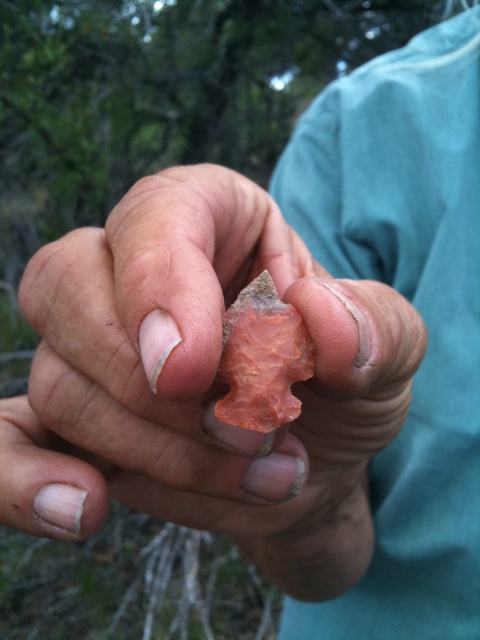
You are an archaeologist examining two matte orange stone objects in the image. Which one is bigger between the matte orange stone arrowhead at center and the matte orange stone at center?

The matte orange stone arrowhead at center is larger than the matte orange stone at center.

You are an archaeologist examining two objects in your hands. You have a matte orange stone arrowhead at center and a matte orange stone at center. Which object is taller?

The matte orange stone arrowhead at center is much taller than the matte orange stone at center.

You are an archaeologist examining the stone tool in the image. You notice two points marked on the tool. Which point is closer to you, point (392,376) or point (240,339)?

Point (240,339) is closer to you because it is in front of point (392,376).